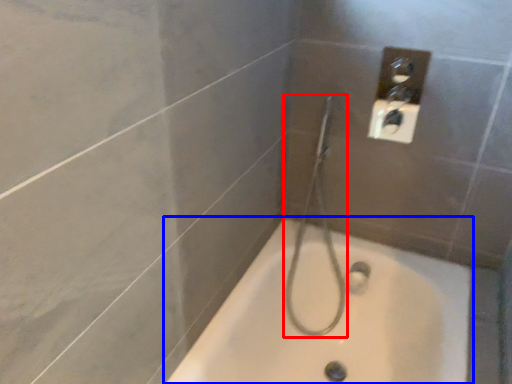
Question: Which object appears farthest to the camera in this image, shower (highlighted by a red box) or bathtub (highlighted by a blue box)?

Choices:
 (A) shower
 (B) bathtub

Answer: (A)